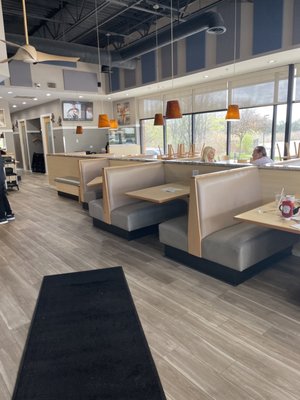
Where is `hardwood floor`? hardwood floor is located at coordinates (256, 333).